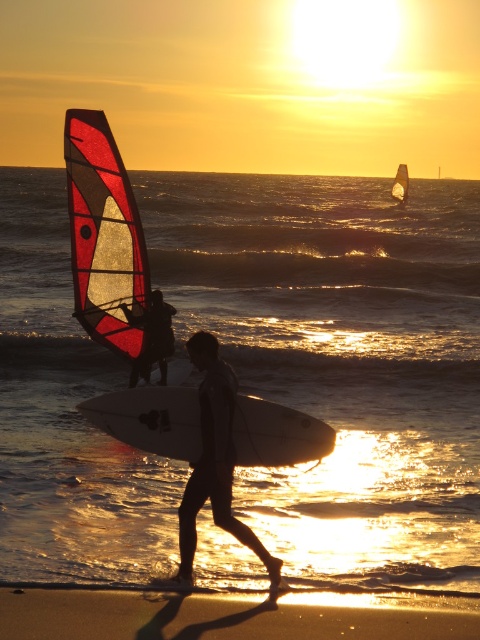
Is translucent red sail at left shorter than white matte surfboard at center?

In fact, translucent red sail at left may be taller than white matte surfboard at center.

Is point (92, 152) more distant than point (235, 420)?

Yes, point (92, 152) is farther from viewer.

The width and height of the screenshot is (480, 640). Find the location of `translucent red sail at left`. translucent red sail at left is located at coordinates (104, 234).

At what (x,y) coordinates should I click in order to perform the action: click on translucent red sail at left. Please return your answer as a coordinate pair (x, y). Looking at the image, I should click on (104, 234).

From the picture: Does translucent plastic water at center have a larger size compared to translucent red sail at left?

Yes.

Is translucent plastic water at center further to the viewer compared to translucent red sail at left?

No, translucent plastic water at center is in front of translucent red sail at left.

Does point (43, 435) come farther from viewer compared to point (120, 166)?

No, (43, 435) is closer to viewer.

Locate an element on the screen. translucent plastic water at center is located at coordinates (342, 356).

Between black wetsuit at center and white glossy sail at upper right, which one appears on the right side from the viewer's perspective?

From the viewer's perspective, white glossy sail at upper right appears more on the right side.

Who is shorter, black wetsuit at center or white glossy sail at upper right?

With less height is white glossy sail at upper right.

Find the location of a particular element. This screenshot has height=640, width=480. black wetsuit at center is located at coordinates (215, 461).

What are the coordinates of `black wetsuit at center` in the screenshot? It's located at (215, 461).